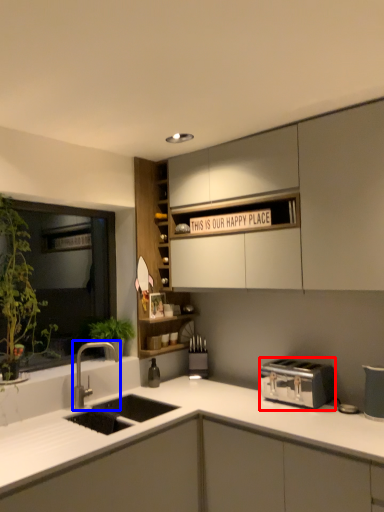
Question: Which object is further to the camera taking this photo, toaster (highlighted by a red box) or tap (highlighted by a blue box)?

Choices:
 (A) toaster
 (B) tap

Answer: (B)